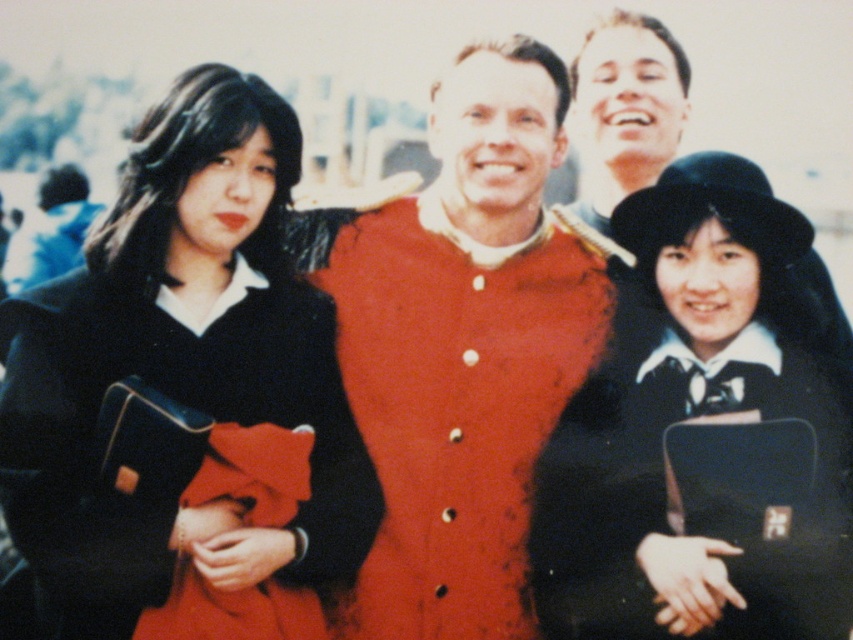
In the scene shown: Between red leather jacket at center and black matte hat at upper right, which one is positioned higher?

red leather jacket at center is above.

Does red leather jacket at center have a lesser height compared to black matte hat at upper right?

No, red leather jacket at center is not shorter than black matte hat at upper right.

Locate an element on the screen. red leather jacket at center is located at coordinates (462, 348).

Where is `red leather jacket at center`? The image size is (853, 640). red leather jacket at center is located at coordinates coord(462,348).

Who is positioned more to the right, black matte jacket at left or red wool coat at center?

Positioned to the right is black matte jacket at left.

Does black matte jacket at left have a greater height compared to red wool coat at center?

Yes.

Which is in front, point (22, 497) or point (67, 198)?

Point (22, 497)

You are a GUI agent. You are given a task and a screenshot of the screen. Output one action in this format:
    pyautogui.click(x=<x>, y=<y>)
    Task: Click on the black matte jacket at left
    The width and height of the screenshot is (853, 640).
    Given the screenshot: What is the action you would take?
    pyautogui.click(x=181, y=364)

Which is in front, point (335, 456) or point (531, 493)?

Point (335, 456) is in front.

Does black matte jacket at left appear on the right side of red leather jacket at center?

No, black matte jacket at left is not to the right of red leather jacket at center.

This screenshot has width=853, height=640. What do you see at coordinates (181, 364) in the screenshot?
I see `black matte jacket at left` at bounding box center [181, 364].

Locate an element on the screen. The image size is (853, 640). black matte jacket at left is located at coordinates (181, 364).